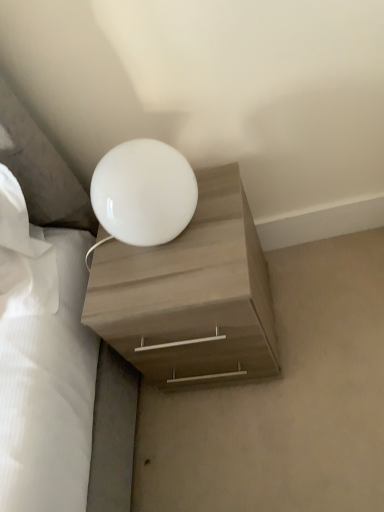
The width and height of the screenshot is (384, 512). What are the coordinates of `free space above matte wood nightstand at center (from a real-world perspective)` in the screenshot? It's located at click(x=168, y=262).